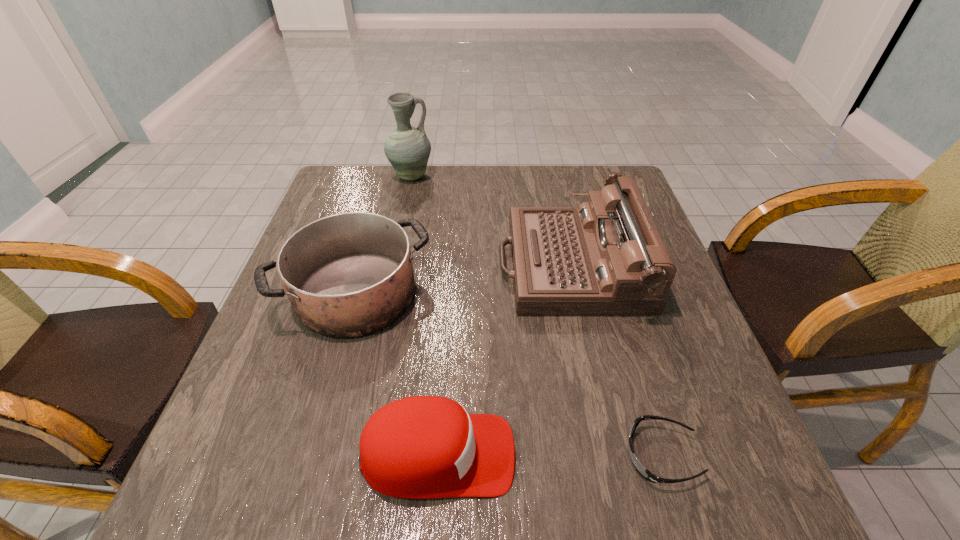
You are a GUI agent. You are given a task and a screenshot of the screen. Output one action in this format:
    pyautogui.click(x=<x>, y=<y>)
    Task: Click on the free space located 0.230m on the back of the third shortest object
    The image size is (960, 540).
    Given the screenshot: What is the action you would take?
    pyautogui.click(x=382, y=202)

The image size is (960, 540). I want to click on vacant space located on the front-facing side of the baseball cap, so tap(717, 455).

Where is `vacant point located 0.250m on the lenses of the shortest object`? vacant point located 0.250m on the lenses of the shortest object is located at coordinates (476, 455).

Identify the location of vacant point located on the lenses of the shortest object. (571, 455).

Identify the location of vacant area situated 0.240m on the lenses of the shortest object. This screenshot has width=960, height=540. (482, 455).

Where is `object positioned at the far edge`? The image size is (960, 540). object positioned at the far edge is located at coordinates (407, 148).

Where is `baseball cap that is at the near edge`? Image resolution: width=960 pixels, height=540 pixels. baseball cap that is at the near edge is located at coordinates (422, 447).

The image size is (960, 540). I want to click on sunglasses present at the near edge, so click(x=645, y=473).

Locate an element on the screen. object that is at the left edge is located at coordinates (346, 275).

Where is `typewriter that is positioned at the right edge`? The height and width of the screenshot is (540, 960). typewriter that is positioned at the right edge is located at coordinates coord(606,257).